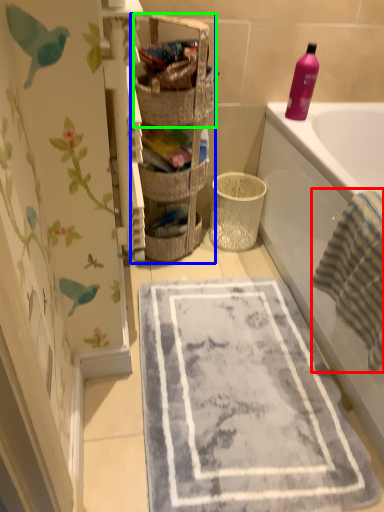
Question: Considering the real-world distances, which object is closest to beach towel (highlighted by a red box)? shelf (highlighted by a blue box) or basket (highlighted by a green box).

Choices:
 (A) shelf
 (B) basket

Answer: (A)